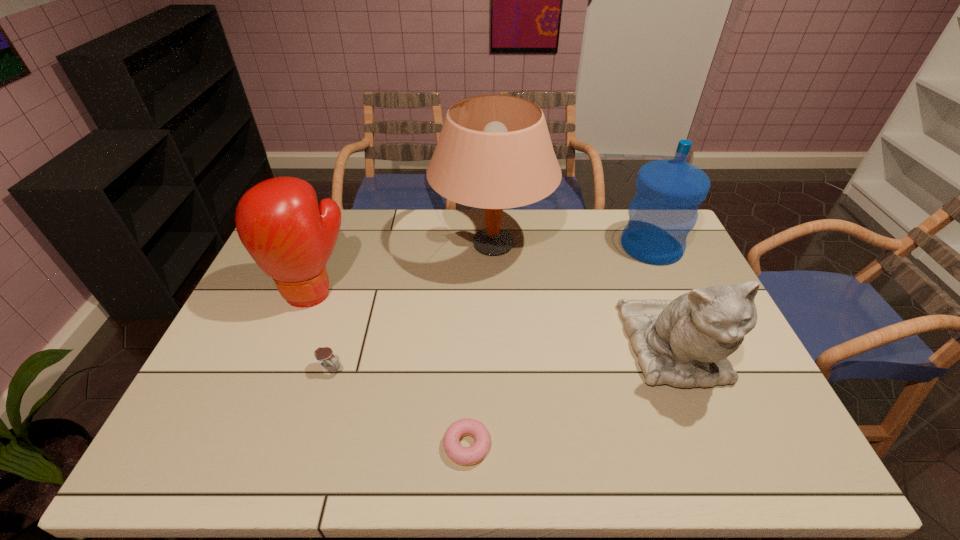
Where is `cat that is at the right edge`? cat that is at the right edge is located at coordinates (685, 342).

I want to click on object at the far right corner, so click(x=663, y=211).

Identify the location of free space at the far edge. (507, 229).

Locate an element on the screen. free region at the near edge is located at coordinates (353, 443).

The height and width of the screenshot is (540, 960). In order to click on free spot at the right edge of the desktop in this screenshot , I will do `click(649, 265)`.

Identify the location of vacant space that's between the watch and the shortest object. (398, 407).

Identify the location of free space between the boxing glove and the doughnut. The height and width of the screenshot is (540, 960). (390, 368).

Find the location of a particular element. vacant area that lies between the fifth tallest object and the water jug is located at coordinates (491, 308).

What are the coordinates of `free spot between the second shortest object and the water jug` in the screenshot? It's located at (491, 308).

Find the location of a particular element. free point between the cat and the boxing glove is located at coordinates (493, 320).